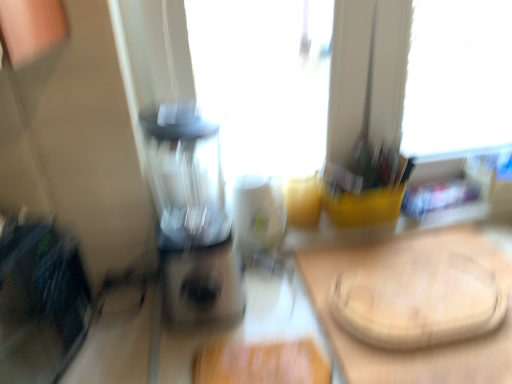
Question: Is transparent plastic blender at center inside or outside of wooden cutting board at center?

Choices:
 (A) inside
 (B) outside

Answer: (B)

Question: From a real-world perspective, is transparent plastic blender at center positioned above or below wooden cutting board at center?

Choices:
 (A) below
 (B) above

Answer: (B)

Question: Estimate the real-world distances between objects in this image. Which object is farther from the white glossy mug at center?

Choices:
 (A) transparent plastic blender at center
 (B) wooden cutting board at center

Answer: (B)

Question: Which of these objects is positioned closest to the white glossy mug at center?

Choices:
 (A) transparent plastic blender at center
 (B) wooden cutting board at center

Answer: (A)